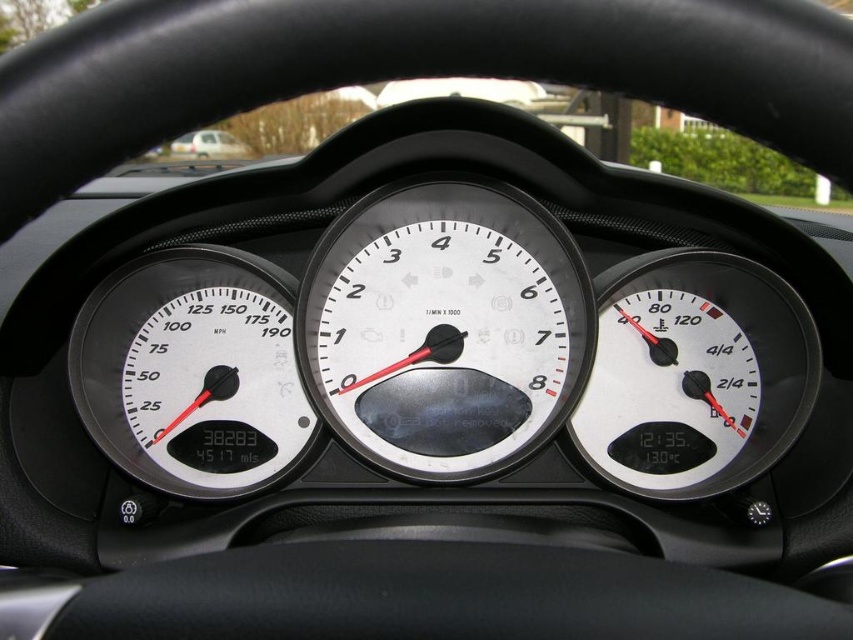
Is white matte fuel gauge at center right above white matte van at upper center?

No, white matte fuel gauge at center right is not above white matte van at upper center.

How much distance is there between white matte fuel gauge at center right and white matte van at upper center?

They are 1.25 meters apart.

Is point (575, 438) in front of point (215, 156)?

Yes, it is in front of point (215, 156).

Identify the location of white matte fuel gauge at center right. Image resolution: width=853 pixels, height=640 pixels. (694, 372).

Is white glossy speedometer at left further to the viewer compared to white matte fuel gauge at center right?

Yes.

Can you confirm if white glossy speedometer at left is wider than white matte fuel gauge at center right?

No, white glossy speedometer at left is not wider than white matte fuel gauge at center right.

Is point (172, 285) positioned before point (682, 342)?

Yes.

What are the coordinates of `white glossy speedometer at left` in the screenshot? It's located at (192, 371).

Does white glossy speedometer at left appear on the right side of white matte van at upper center?

Yes, white glossy speedometer at left is to the right of white matte van at upper center.

Between white glossy speedometer at left and white matte van at upper center, which one appears on the right side from the viewer's perspective?

From the viewer's perspective, white glossy speedometer at left appears more on the right side.

The image size is (853, 640). What do you see at coordinates (192, 371) in the screenshot?
I see `white glossy speedometer at left` at bounding box center [192, 371].

Locate an element on the screen. This screenshot has width=853, height=640. white glossy speedometer at left is located at coordinates (192, 371).